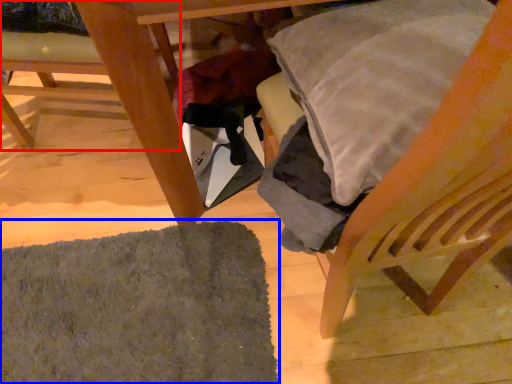
Question: Which of the following is the closest to the observer, chair (highlighted by a red box) or mat (highlighted by a blue box)?

Choices:
 (A) chair
 (B) mat

Answer: (A)